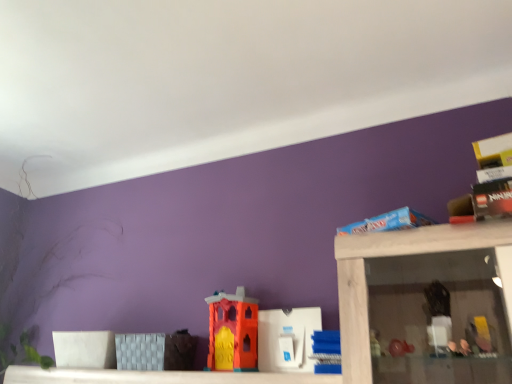
In order to face orange matte plastic castle at center, marked as the 3th toy in a right-to-left arrangement, should I rotate leftwards or rightwards?

A 3.273 degree turn to the left will do.

At what (x,y) coordinates should I click in order to perform the action: click on orange matte plastic castle at center, placed as the first toy when sorted from left to right. Please return your answer as a coordinate pair (x, y). Looking at the image, I should click on (232, 332).

What is the approximate width of blue plastic blocks at center, which is the 3th toy from left to right?

It is 7.14 inches.

Describe the element at coordinates (326, 352) in the screenshot. I see `blue plastic blocks at center, the first toy viewed from the right` at that location.

What do you see at coordinates (287, 339) in the screenshot?
I see `white plastic toy at center, which is the second toy in right-to-left order` at bounding box center [287, 339].

Identify the location of orange matte plastic castle at center, placed as the first toy when sorted from left to right. (232, 332).

The width and height of the screenshot is (512, 384). Find the location of `toy located on the right of white plastic toy at center, which is the second toy in right-to-left order`. toy located on the right of white plastic toy at center, which is the second toy in right-to-left order is located at coordinates (326, 352).

Is blue plastic blocks at center, the first toy viewed from the right, not close to white plastic toy at center, which is the second toy in left-to-right order?

No, there isn't a large distance between blue plastic blocks at center, the first toy viewed from the right, and white plastic toy at center, which is the second toy in left-to-right order.

Between point (309, 356) and point (271, 324), which one is positioned behind?

The point (271, 324) is farther from the camera.

Considering the positions of point (215, 291) and point (258, 342), is point (215, 291) closer or farther from the camera than point (258, 342)?

Point (215, 291) appears to be farther away from the viewer than point (258, 342).

Is orange matte plastic castle at center, placed as the first toy when sorted from left to right, smaller than white plastic toy at center, which is the second toy in left-to-right order?

No.

From the image's perspective, which one is positioned lower, orange matte plastic castle at center, placed as the first toy when sorted from left to right, or white plastic toy at center, which is the second toy in left-to-right order?

white plastic toy at center, which is the second toy in left-to-right order, appears lower in the image.

In the image, is orange matte plastic castle at center, marked as the 3th toy in a right-to-left arrangement, on the left side or the right side of white plastic toy at center, which is the second toy in right-to-left order?

Clearly, orange matte plastic castle at center, marked as the 3th toy in a right-to-left arrangement, is on the left of white plastic toy at center, which is the second toy in right-to-left order, in the image.

Does orange matte plastic castle at center, marked as the 3th toy in a right-to-left arrangement, appear on the right side of blue plastic blocks at center, which is the 3th toy from left to right?

No, orange matte plastic castle at center, marked as the 3th toy in a right-to-left arrangement, is not to the right of blue plastic blocks at center, which is the 3th toy from left to right.

From a real-world perspective, is orange matte plastic castle at center, marked as the 3th toy in a right-to-left arrangement, above or below blue plastic blocks at center, which is the 3th toy from left to right?

Clearly, from a real-world perspective, orange matte plastic castle at center, marked as the 3th toy in a right-to-left arrangement, is above blue plastic blocks at center, which is the 3th toy from left to right.

Are orange matte plastic castle at center, marked as the 3th toy in a right-to-left arrangement, and blue plastic blocks at center, the first toy viewed from the right, making contact?

No, orange matte plastic castle at center, marked as the 3th toy in a right-to-left arrangement, is not in contact with blue plastic blocks at center, the first toy viewed from the right.

Is orange matte plastic castle at center, marked as the 3th toy in a right-to-left arrangement, aimed at blue plastic blocks at center, the first toy viewed from the right?

No, orange matte plastic castle at center, marked as the 3th toy in a right-to-left arrangement, does not turn towards blue plastic blocks at center, the first toy viewed from the right.

Is white plastic toy at center, which is the second toy in left-to-right order, in front of or behind orange matte plastic castle at center, marked as the 3th toy in a right-to-left arrangement, in the image?

Visually, white plastic toy at center, which is the second toy in left-to-right order, is located in front of orange matte plastic castle at center, marked as the 3th toy in a right-to-left arrangement.

From a real-world perspective, between white plastic toy at center, which is the second toy in left-to-right order, and orange matte plastic castle at center, marked as the 3th toy in a right-to-left arrangement, who is vertically higher?

orange matte plastic castle at center, marked as the 3th toy in a right-to-left arrangement.

Identify the location of the 1st toy to the right of the orange matte plastic castle at center, marked as the 3th toy in a right-to-left arrangement, counting from the anchor's position. This screenshot has width=512, height=384. (287, 339).

Looking at their sizes, would you say white plastic toy at center, which is the second toy in left-to-right order, is wider or thinner than orange matte plastic castle at center, placed as the first toy when sorted from left to right?

Considering their sizes, white plastic toy at center, which is the second toy in left-to-right order, looks slimmer than orange matte plastic castle at center, placed as the first toy when sorted from left to right.

Can you tell me how much blue plastic blocks at center, which is the 3th toy from left to right, and orange matte plastic castle at center, marked as the 3th toy in a right-to-left arrangement, differ in facing direction?

blue plastic blocks at center, which is the 3th toy from left to right, and orange matte plastic castle at center, marked as the 3th toy in a right-to-left arrangement, are facing 1.8 degrees away from each other.

Would you say blue plastic blocks at center, the first toy viewed from the right, is outside orange matte plastic castle at center, marked as the 3th toy in a right-to-left arrangement?

Indeed, blue plastic blocks at center, the first toy viewed from the right, is completely outside orange matte plastic castle at center, marked as the 3th toy in a right-to-left arrangement.

Between blue plastic blocks at center, the first toy viewed from the right, and orange matte plastic castle at center, marked as the 3th toy in a right-to-left arrangement, which one has larger size?

orange matte plastic castle at center, marked as the 3th toy in a right-to-left arrangement, is bigger.

Is blue plastic blocks at center, which is the 3th toy from left to right, touching orange matte plastic castle at center, placed as the first toy when sorted from left to right?

No, blue plastic blocks at center, which is the 3th toy from left to right, is not next to orange matte plastic castle at center, placed as the first toy when sorted from left to right.

Which is closer to the camera, (289,359) or (321,346)?

Clearly, point (289,359) is more distant from the camera than point (321,346).

Which object is closer to the camera taking this photo, white plastic toy at center, which is the second toy in right-to-left order, or blue plastic blocks at center, the first toy viewed from the right?

blue plastic blocks at center, the first toy viewed from the right.

Is blue plastic blocks at center, the first toy viewed from the right, at the back of white plastic toy at center, which is the second toy in right-to-left order?

No, white plastic toy at center, which is the second toy in right-to-left order, is not facing the opposite direction of blue plastic blocks at center, the first toy viewed from the right.

I want to click on the 1st toy to the left of the blue plastic blocks at center, the first toy viewed from the right, counting from the anchor's position, so click(287, 339).

Find the location of a particular element. the 1st toy above the white plastic toy at center, which is the second toy in right-to-left order (from the image's perspective) is located at coordinates (232, 332).

When comparing their distances from blue plastic blocks at center, the first toy viewed from the right, does orange matte plastic castle at center, placed as the first toy when sorted from left to right, or white plastic toy at center, which is the second toy in left-to-right order, seem closer?

Among the two, white plastic toy at center, which is the second toy in left-to-right order, is located nearer to blue plastic blocks at center, the first toy viewed from the right.

Based on their spatial positions, is orange matte plastic castle at center, marked as the 3th toy in a right-to-left arrangement, or blue plastic blocks at center, the first toy viewed from the right, closer to white plastic toy at center, which is the second toy in left-to-right order?

The object closer to white plastic toy at center, which is the second toy in left-to-right order, is orange matte plastic castle at center, marked as the 3th toy in a right-to-left arrangement.

When comparing their distances from white plastic toy at center, which is the second toy in right-to-left order, does blue plastic blocks at center, which is the 3th toy from left to right, or orange matte plastic castle at center, marked as the 3th toy in a right-to-left arrangement, seem further?

Based on the image, blue plastic blocks at center, which is the 3th toy from left to right, appears to be further to white plastic toy at center, which is the second toy in right-to-left order.

Considering their positions, is white plastic toy at center, which is the second toy in right-to-left order, positioned further to orange matte plastic castle at center, placed as the first toy when sorted from left to right, than blue plastic blocks at center, the first toy viewed from the right?

Based on the image, blue plastic blocks at center, the first toy viewed from the right, appears to be further to orange matte plastic castle at center, placed as the first toy when sorted from left to right.

Considering their positions, is blue plastic blocks at center, the first toy viewed from the right, positioned closer to orange matte plastic castle at center, placed as the first toy when sorted from left to right, than white plastic toy at center, which is the second toy in left-to-right order?

Based on the image, white plastic toy at center, which is the second toy in left-to-right order, appears to be nearer to orange matte plastic castle at center, placed as the first toy when sorted from left to right.

Which object lies further to the anchor point blue plastic blocks at center, the first toy viewed from the right, white plastic toy at center, which is the second toy in right-to-left order, or orange matte plastic castle at center, marked as the 3th toy in a right-to-left arrangement?

The object further to blue plastic blocks at center, the first toy viewed from the right, is orange matte plastic castle at center, marked as the 3th toy in a right-to-left arrangement.

Find the location of a particular element. toy between orange matte plastic castle at center, placed as the first toy when sorted from left to right, and blue plastic blocks at center, the first toy viewed from the right, in the horizontal direction is located at coordinates (287, 339).